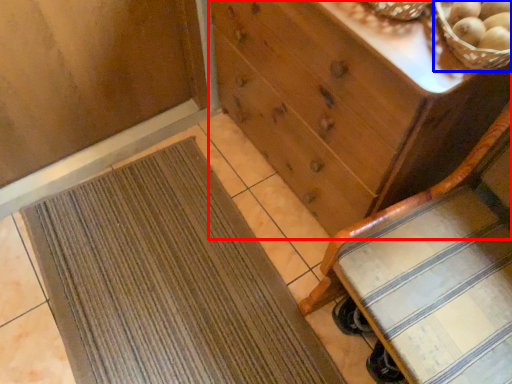
Question: Which point is closer to the camera, chest of drawers (highlighted by a red box) or basket (highlighted by a blue box)?

Choices:
 (A) chest of drawers
 (B) basket

Answer: (B)